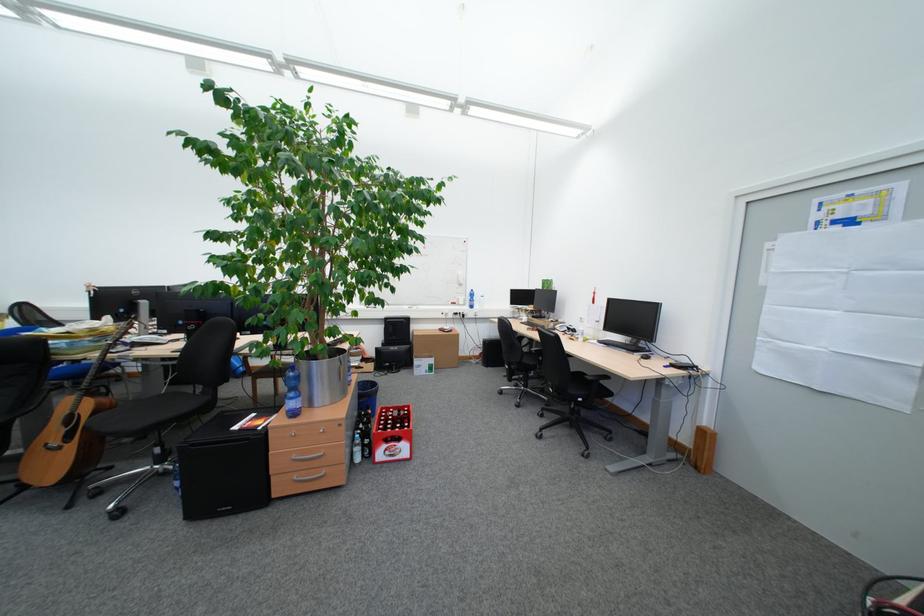
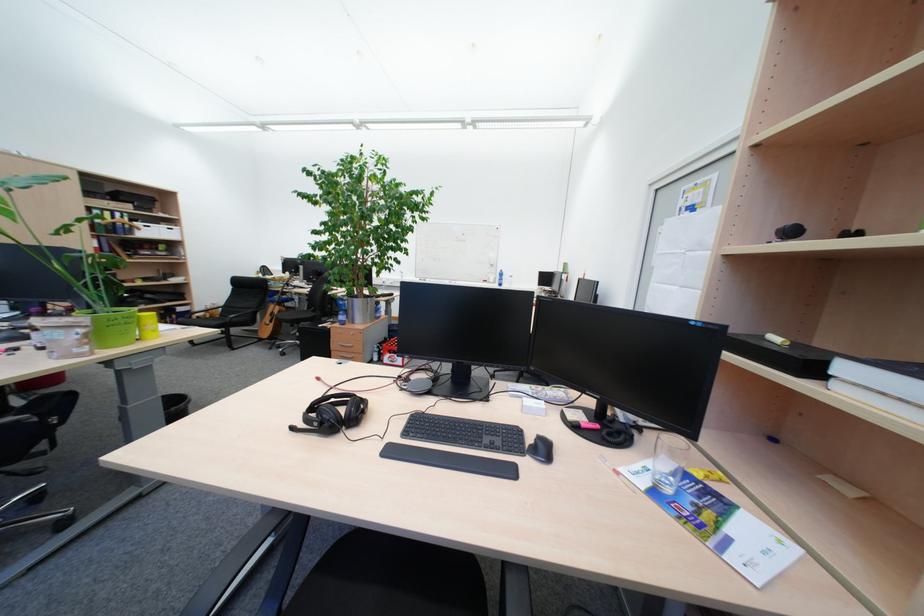
The point at (781, 246) is marked in the first image. Where is the corresponding point in the second image?

(671, 230)